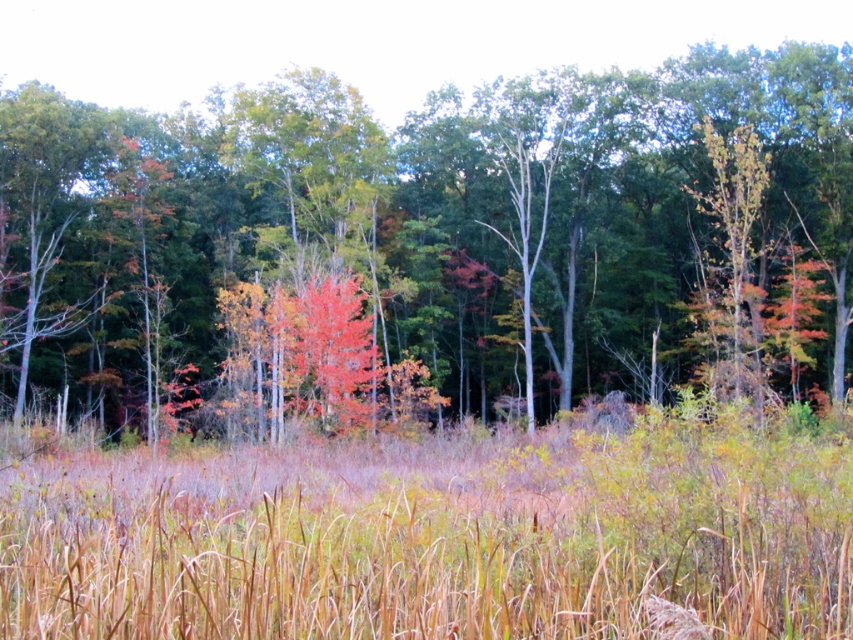
Which is behind, point (490, 115) or point (115, 552)?

The point (490, 115) is more distant.

Can you confirm if smooth red tree at center is bigger than brown dry grass at center?

Indeed, smooth red tree at center has a larger size compared to brown dry grass at center.

What do you see at coordinates (445, 228) in the screenshot? I see `smooth red tree at center` at bounding box center [445, 228].

Where is `smooth red tree at center`? This screenshot has height=640, width=853. smooth red tree at center is located at coordinates coord(445,228).

Can you confirm if brown dry grass at center is positioned to the right of green matte tree at center?

In fact, brown dry grass at center is to the left of green matte tree at center.

Does brown dry grass at center have a larger size compared to green matte tree at center?

Actually, brown dry grass at center might be smaller than green matte tree at center.

You are a GUI agent. You are given a task and a screenshot of the screen. Output one action in this format:
    pyautogui.click(x=<x>, y=<y>)
    Task: Click on the brown dry grass at center
    The height and width of the screenshot is (640, 853).
    Given the screenshot: What is the action you would take?
    pyautogui.click(x=450, y=547)

I want to click on brown dry grass at center, so click(450, 547).

Does smooth red tree at center lie in front of green matte tree at center?

No, it is not.

Between smooth red tree at center and green matte tree at center, which one is positioned lower?

green matte tree at center is below.

Between point (819, 252) and point (758, 291), which one is positioned behind?

Positioned behind is point (819, 252).

Image resolution: width=853 pixels, height=640 pixels. What are the coordinates of `smooth red tree at center` in the screenshot? It's located at (445, 228).